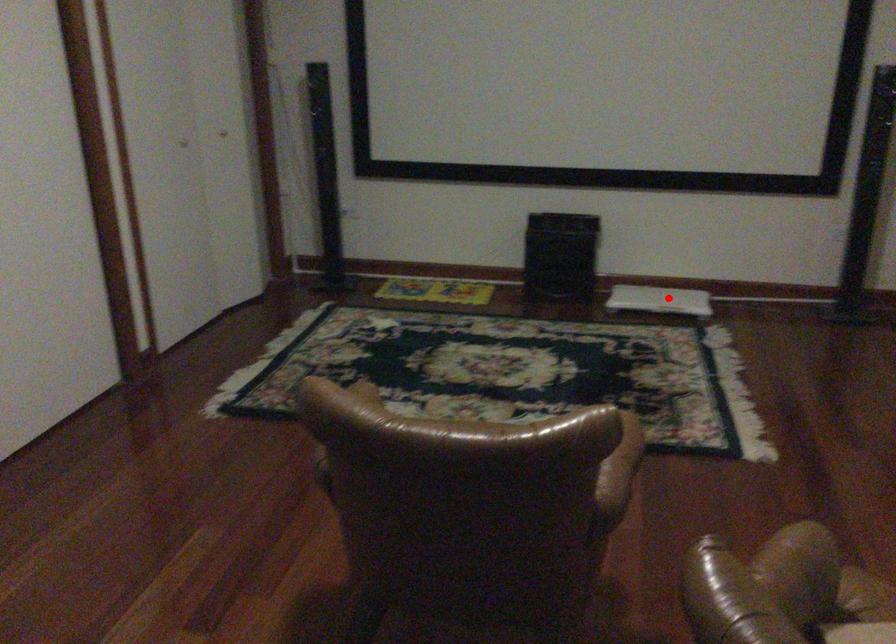
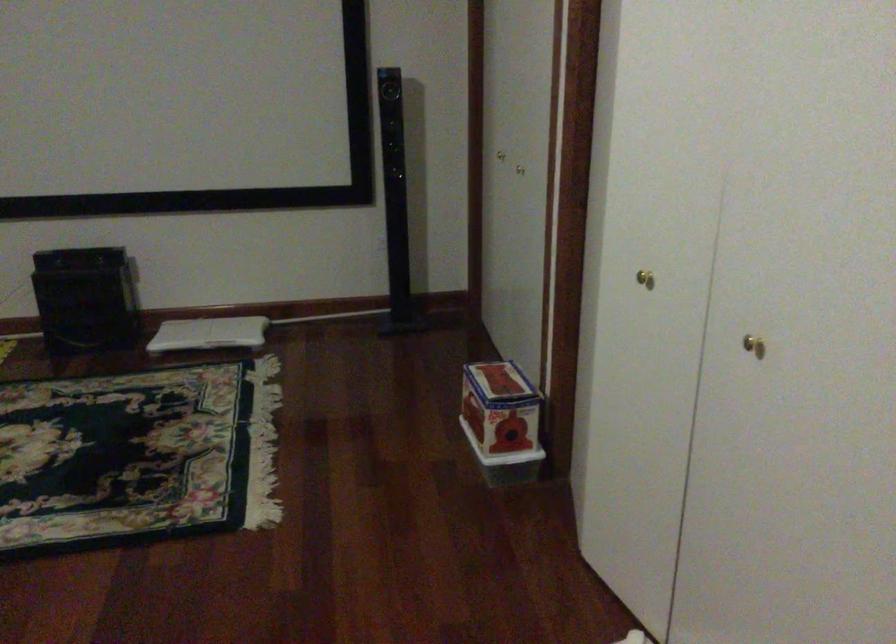
Where in the second image is the point corresponding to the highlighted location from the first image?

(209, 333)